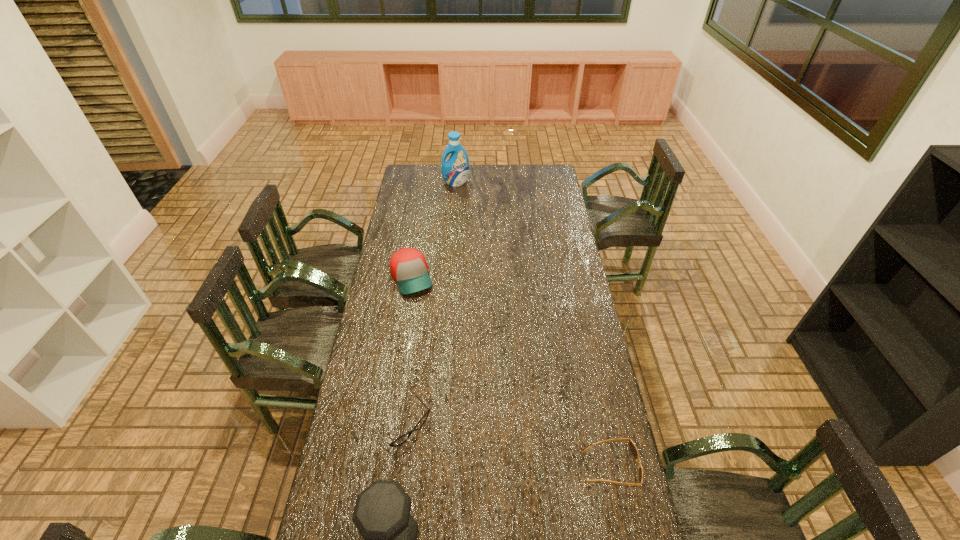
Where is `vacant space at the far edge`? The width and height of the screenshot is (960, 540). vacant space at the far edge is located at coordinates (516, 168).

Locate an element on the screen. free spot at the near edge of the desktop is located at coordinates (564, 518).

The height and width of the screenshot is (540, 960). What are the coordinates of `free space at the left edge of the desktop` in the screenshot? It's located at (360, 388).

You are a GUI agent. You are given a task and a screenshot of the screen. Output one action in this format:
    pyautogui.click(x=<x>, y=<y>)
    Task: Click on the vacant space at the right edge of the desktop
    The height and width of the screenshot is (540, 960).
    Given the screenshot: What is the action you would take?
    pyautogui.click(x=564, y=312)

The image size is (960, 540). In the image, there is a desktop. What are the coordinates of `vacant space at the far right corner` in the screenshot? It's located at (532, 179).

At what (x,y) coordinates should I click in order to perform the action: click on vacant space that's between the farthest object and the spectacles. Please return your answer as a coordinate pair (x, y). This screenshot has width=960, height=540. Looking at the image, I should click on (430, 304).

I want to click on unoccupied area between the third shortest object and the tallest object, so click(434, 230).

Find the location of a particular element. This screenshot has height=540, width=960. vacant region between the farthest object and the third tallest object is located at coordinates (434, 230).

You are a GUI agent. You are given a task and a screenshot of the screen. Output one action in this format:
    pyautogui.click(x=<x>, y=<y>)
    Task: Click on the vacant point located between the tallest object and the fourth tallest object
    This screenshot has width=960, height=540.
    Given the screenshot: What is the action you would take?
    pyautogui.click(x=430, y=304)

Where is `free space between the farthest object and the second farthest object`? free space between the farthest object and the second farthest object is located at coordinates (434, 230).